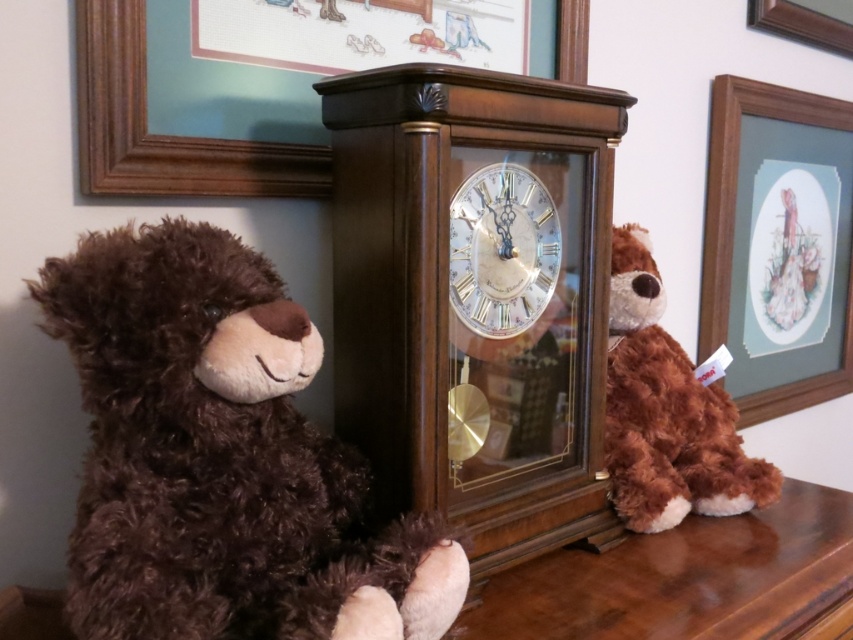
Question: Which object is farther from the camera taking this photo?

Choices:
 (A) brown plush toy at right
 (B) brown plush bear at left

Answer: (A)

Question: Estimate the real-world distances between objects in this image. Which object is closer to the white glossy clock at center?

Choices:
 (A) brown plush toy at right
 (B) brown plush bear at left
 (C) matte wood picture frame at upper right

Answer: (A)

Question: Is white glossy clock at center below wooden picture frame at upper right?

Choices:
 (A) no
 (B) yes

Answer: (B)

Question: Is white glossy clock at center below wooden picture frame at upper right?

Choices:
 (A) no
 (B) yes

Answer: (B)

Question: Among these points, which one is nearest to the camera?

Choices:
 (A) (431, 625)
 (B) (753, 401)
 (C) (498, 308)
 (D) (86, 144)

Answer: (A)

Question: Can you confirm if matte wood picture frame at upper right is bigger than wooden picture frame at upper right?

Choices:
 (A) yes
 (B) no

Answer: (A)